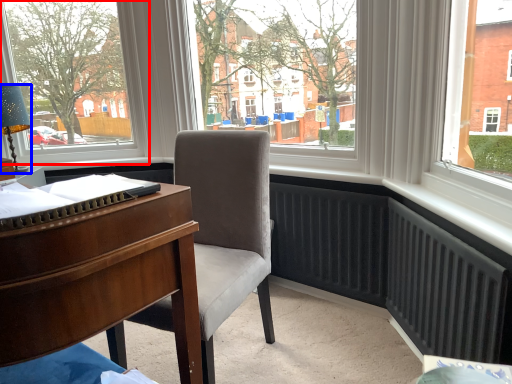
Question: Which object is closer to the camera taking this photo, window (highlighted by a red box) or lamp (highlighted by a blue box)?

Choices:
 (A) window
 (B) lamp

Answer: (B)